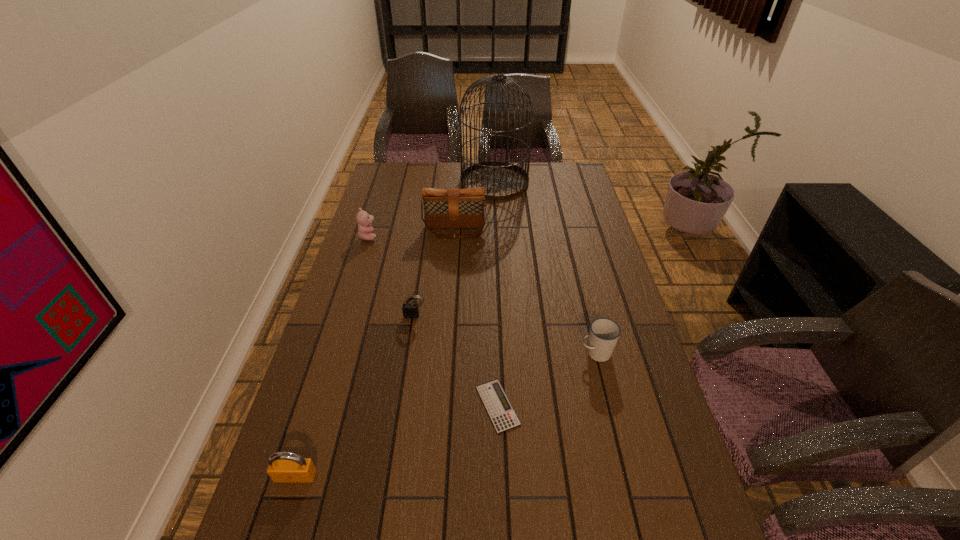
Where is `calculator`? This screenshot has height=540, width=960. calculator is located at coordinates [x=495, y=400].

This screenshot has width=960, height=540. Find the location of `the second nearest object`. the second nearest object is located at coordinates (495, 400).

You are a GUI agent. You are given a task and a screenshot of the screen. Output one action in this format:
    pyautogui.click(x=<x>, y=<y>)
    Task: Click on the vacant point located 0.220m on the right of the tallest object
    This screenshot has width=960, height=540.
    Given the screenshot: What is the action you would take?
    pyautogui.click(x=580, y=182)

Where is `vacant point located on the front-facing side of the sixth shortest object`? The width and height of the screenshot is (960, 540). vacant point located on the front-facing side of the sixth shortest object is located at coordinates (454, 253).

I want to click on vacant space positioned at the face of the teddy bear, so click(x=470, y=237).

Identify the location of free spot located 0.310m with a handle on the side of the rightmost object. (468, 353).

This screenshot has width=960, height=540. I want to click on vacant point located 0.220m with a handle on the side of the rightmost object, so click(500, 353).

Image resolution: width=960 pixels, height=540 pixels. Identify the location of free region located 0.400m with a handle on the side of the rightmost object. (435, 353).

The image size is (960, 540). Find the location of `vacant space located with the keyhole on the front of the shorter padlock`. vacant space located with the keyhole on the front of the shorter padlock is located at coordinates (402, 404).

Find the location of a particular element. vacant space located 0.350m on the left of the second nearest object is located at coordinates (335, 406).